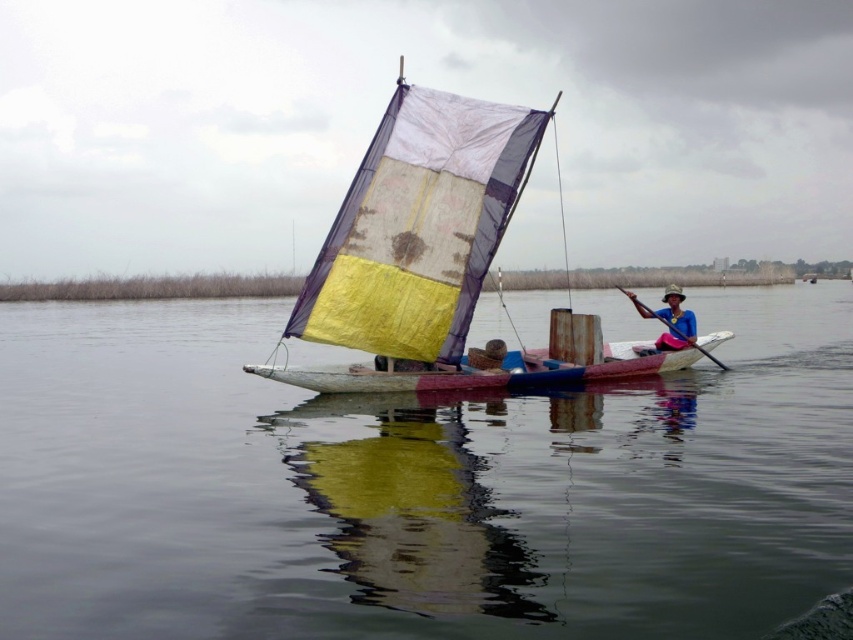
You are standing on the dock and see the point at coordinates (440, 262). What object does this point correspond to?

The point at coordinates (440, 262) corresponds to the yellow fabric sailboat at center.

You are a passenger on the sailboat and want to grab the closest object to you. Which one should you reach for, the blue fabric hat at center or the wooden smooth paddle at center?

The blue fabric hat at center is positioned on the left side of wooden smooth paddle at center, so it is closer to you if you are sitting in the center of the boat. Reach for the blue fabric hat at center first.

You are standing on the dock and see the blue fabric hat at center and a camera somewhere in the scene. According to the description, how far apart are they?

The blue fabric hat at center and camera are 15.84 meters apart from each other.